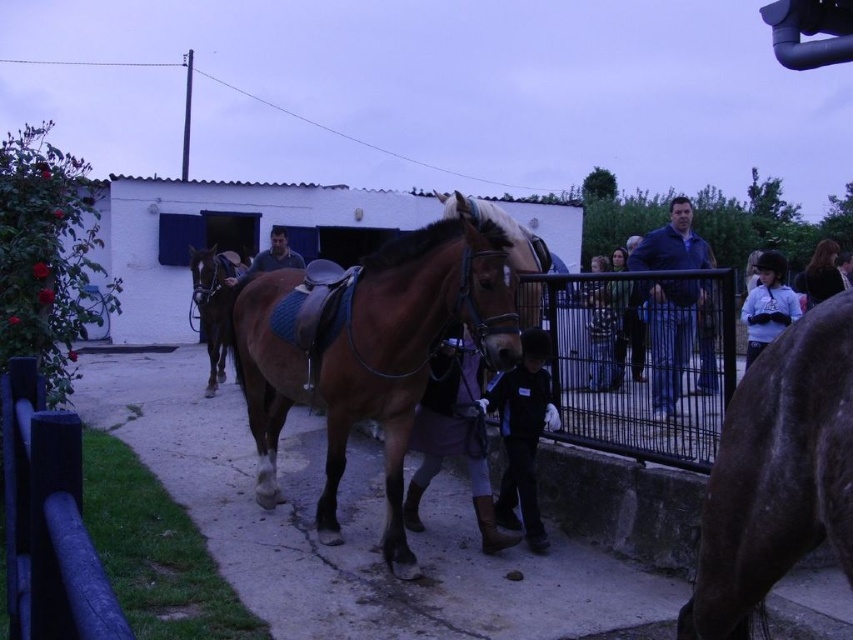
You are a photographer trying to capture both the brown glossy horse at right and the brown glossy horse at center in a single frame. Based on their sizes in the image, which horse would appear smaller in the photo?

The brown glossy horse at right would appear smaller in the photo because it occupies less space than the brown glossy horse at center.

You are a photographer setting up a tripod in the middle of the scene. You need to ensure that the tripod legs do not extend beyond the metallic wire fence at center and also do not interfere with the dark brown hair at upper right. Given that the tripod legs can extend up to 1 meter in width, can you safely set up the tripod without exceeding the fence or getting too close to the hair?

The metallic wire fence at center is wider than the dark brown hair at upper right. Since the fence is wider, the tripod legs can extend up to 1 meter within the fence area without exceeding its width. However, the dark brown hair at upper right is narrower, so you must ensure the tripod does not encroach into that space. The setup is possible as long as the tripod stays within the fence boundaries and avoids the narrower hair area.